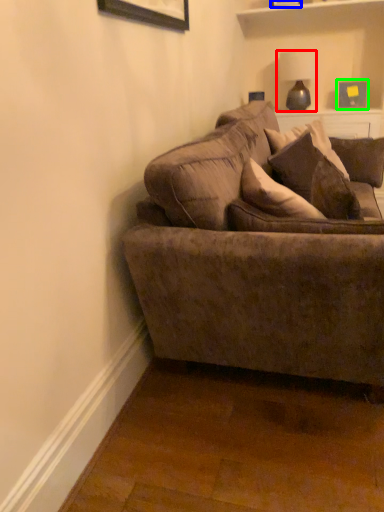
Question: Which object is positioned closest to lamp (highlighted by a red box)? Select from picture frame (highlighted by a blue box) and picture frame (highlighted by a green box).

Choices:
 (A) picture frame
 (B) picture frame

Answer: (B)